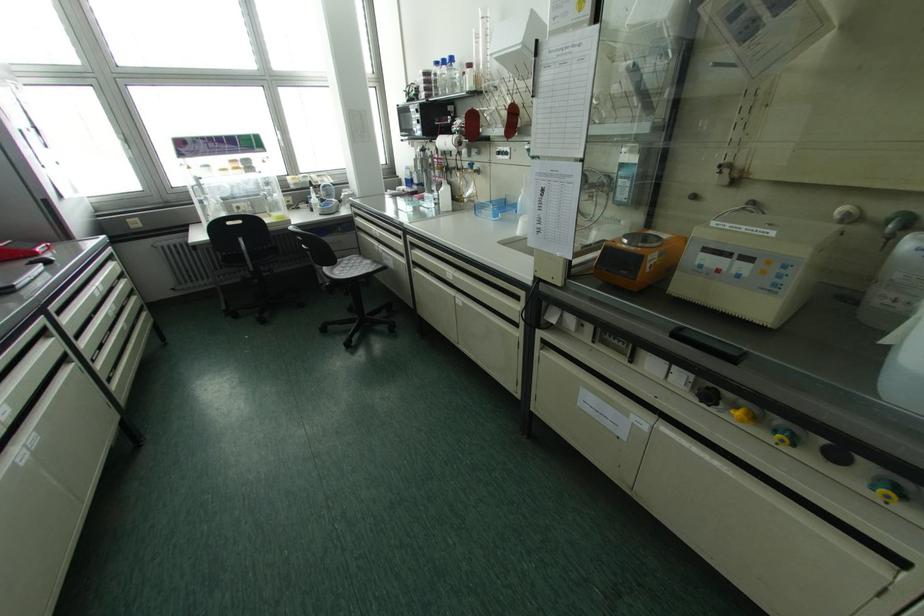
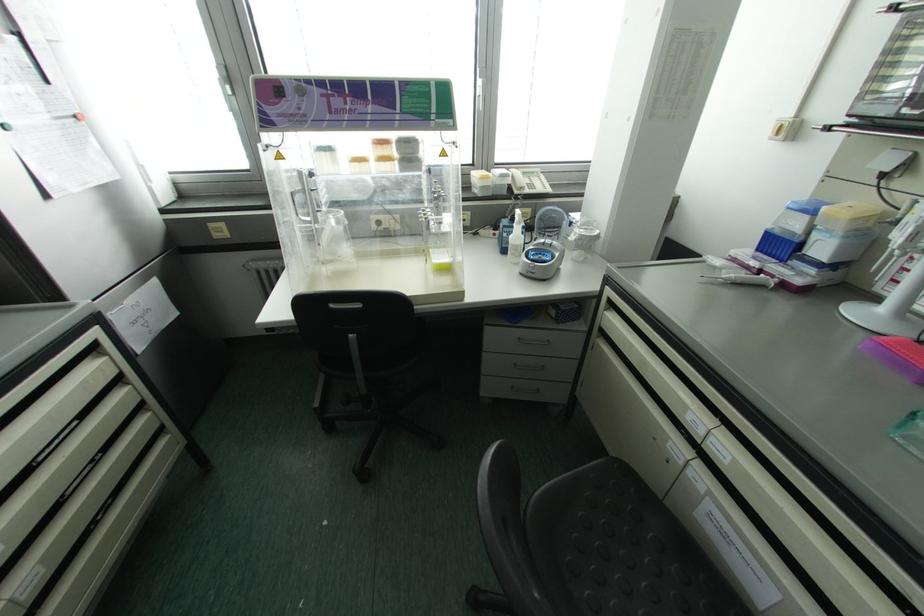
Locate, in the second image, the point that corresponds to [216,209] in the first image.

(334, 238)